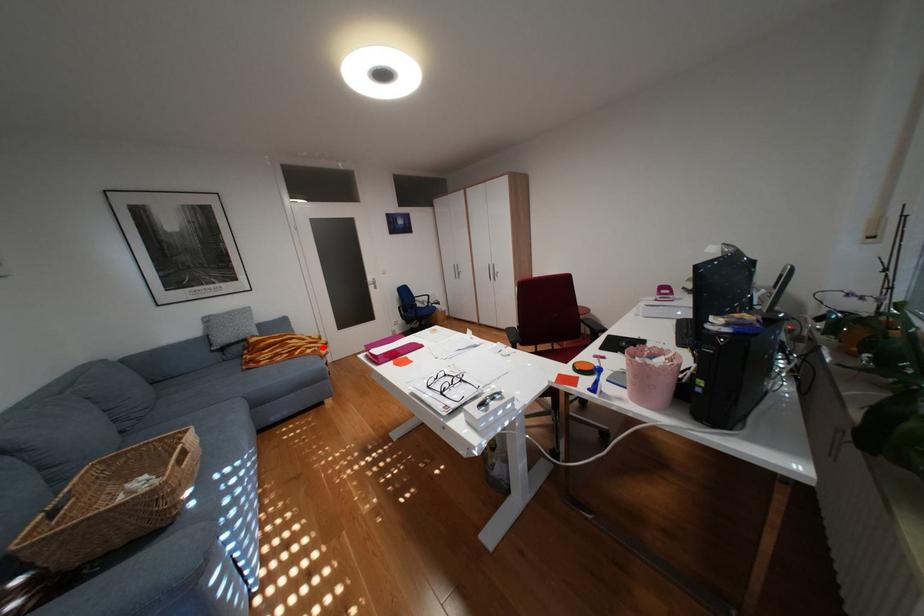
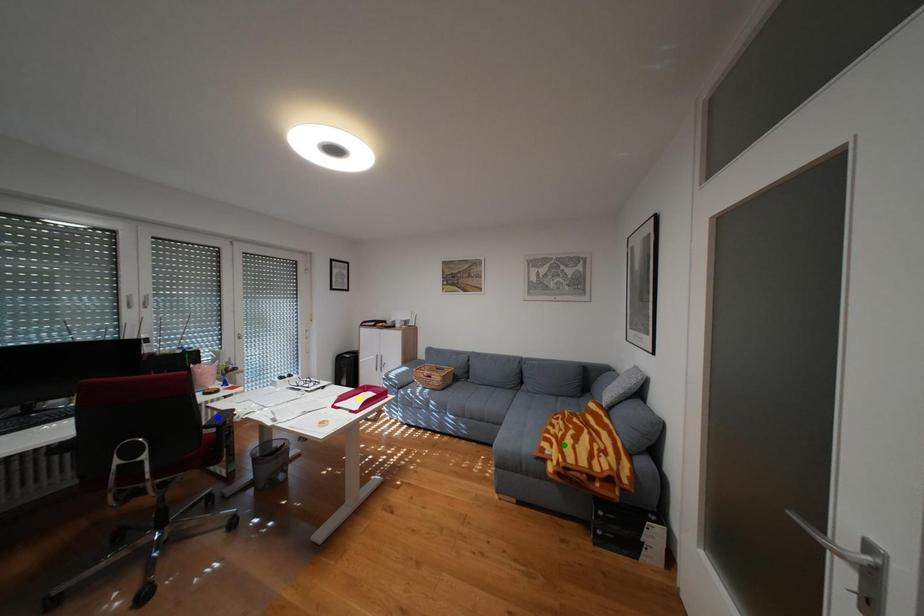
Question: I am providing you with two images of the same scene from different viewpoints. A red point is marked on the first image. You are given multiple points on the second image. Which spot in image 2 lines up with the point in image 1?

Choices:
 (A) blue point
 (B) yellow point
 (C) green point

Answer: (C)